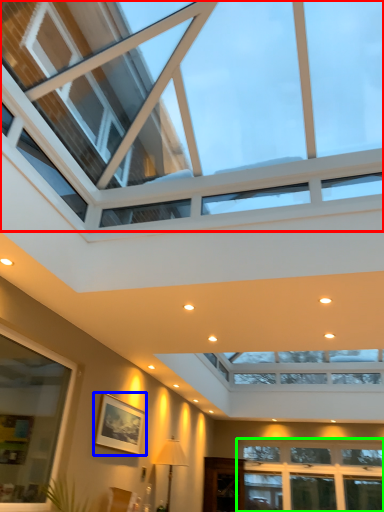
Question: Considering the real-world distances, which object is farthest from window (highlighted by a red box)? picture frame (highlighted by a blue box) or window (highlighted by a green box)?

Choices:
 (A) picture frame
 (B) window

Answer: (B)